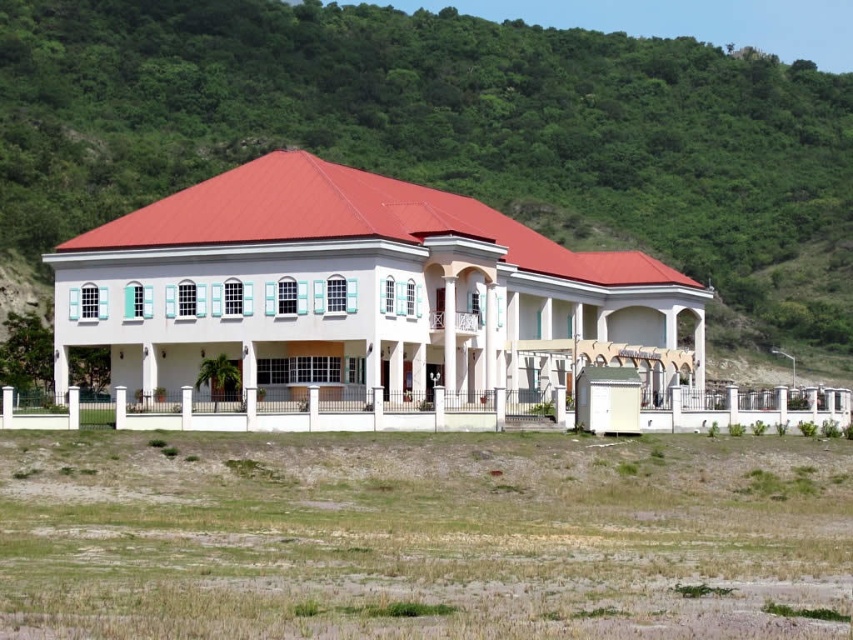
Question: Which of the following is the closest to the observer?

Choices:
 (A) (717, 156)
 (B) (350, 257)

Answer: (B)

Question: Does green leafy hillside at upper center lie in front of white glossy gazebo at center?

Choices:
 (A) no
 (B) yes

Answer: (A)

Question: Which point is farther from the camera taking this photo?

Choices:
 (A) (397, 189)
 (B) (490, 54)

Answer: (B)

Question: Is green leafy hillside at upper center wider than white glossy gazebo at center?

Choices:
 (A) yes
 (B) no

Answer: (A)

Question: Does green leafy hillside at upper center appear on the left side of white glossy gazebo at center?

Choices:
 (A) yes
 (B) no

Answer: (A)